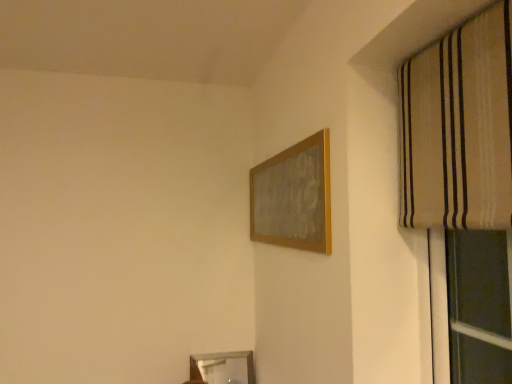
Image resolution: width=512 pixels, height=384 pixels. What do you see at coordinates (223, 367) in the screenshot?
I see `silver metallic window frame at lower center` at bounding box center [223, 367].

Locate an element on the screen. silver metallic window frame at lower center is located at coordinates (223, 367).

What is the approximate width of silver metallic window frame at lower center?

silver metallic window frame at lower center is 1.18 inches in width.

Find the location of `silver metallic window frame at lower center`. silver metallic window frame at lower center is located at coordinates (223, 367).